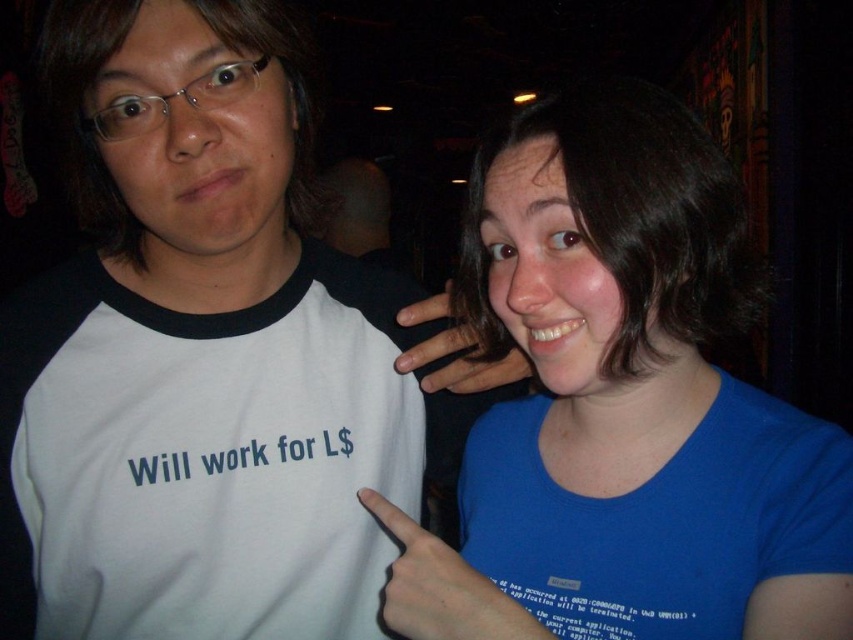
From the picture: You are at a party and see the blue cotton shirt at right and the blue fabric hand at center. Which object is covering the other?

The blue cotton shirt at right is positioned over the blue fabric hand at center, so it is covering it.

Looking at this image, you are a photographer at the event and need to ensure that both hands in the image are visible in the final photo. Given that the blue fabric hand at center and the matte skin hand at center are overlapping, which hand should you adjust to make sure both are fully visible?

The blue fabric hand at center is larger in size compared to the matte skin hand at center. To ensure both hands are fully visible, you should adjust the larger blue fabric hand at center to move it slightly so that it doesn

You are a photographer at the event and need to ensure that both the blue cotton shirt at right and the blue fabric hand at center are visible in a closeup shot. Given their sizes, which object should you focus on to capture both without cropping?

The blue cotton shirt at right is larger in size than the blue fabric hand at center, so focusing on the blue cotton shirt at right would allow both objects to be visible in the frame without cropping.